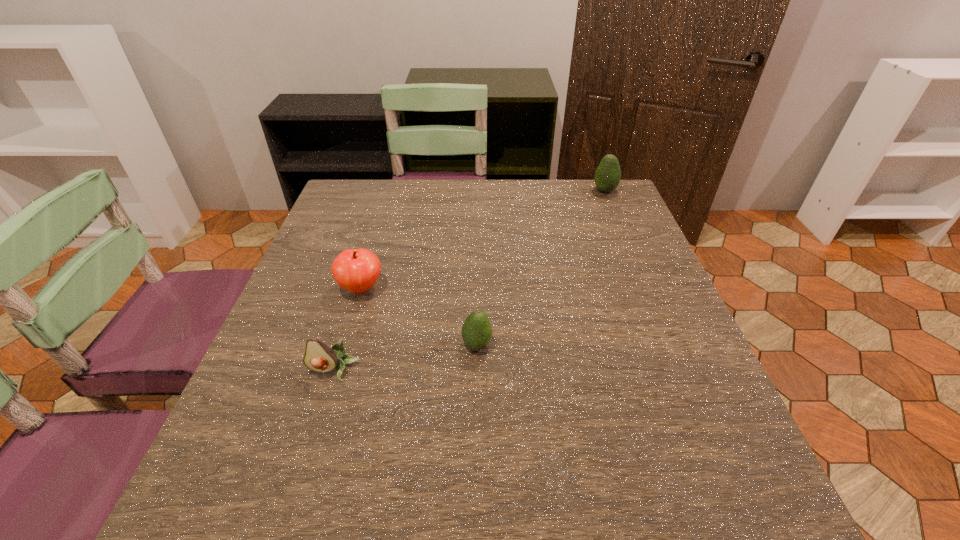
In order to click on vacant area that lies between the second farthest object and the rightmost avocado in this screenshot , I will do `click(483, 240)`.

Identify the location of vacant area between the farthest object and the apple. (483, 240).

This screenshot has width=960, height=540. In order to click on the closest object relative to the second avocado from left to right in this screenshot , I will do `click(319, 357)`.

Identify which object is the third nearest to the nearest avocado. Please provide its 2D coordinates. Your answer should be formatted as a tuple, i.e. [(x, y)], where the tuple contains the x and y coordinates of a point satisfying the conditions above.

[(607, 177)]

Where is `avocado that is the nearest to the third object from left to right`? This screenshot has height=540, width=960. avocado that is the nearest to the third object from left to right is located at coordinates (319, 357).

Choose which avocado is the second nearest neighbor to the second nearest object. Please provide its 2D coordinates. Your answer should be formatted as a tuple, i.e. [(x, y)], where the tuple contains the x and y coordinates of a point satisfying the conditions above.

[(607, 177)]

I want to click on vacant region that satisfies the following two spatial constraints: 1. on the back side of the second nearest object; 2. on the left side of the farthest object, so (478, 191).

Locate an element on the screen. The height and width of the screenshot is (540, 960). vacant space that satisfies the following two spatial constraints: 1. on the back side of the third nearest object; 2. on the left side of the rightmost avocado is located at coordinates (391, 191).

Identify the location of free point that satisfies the following two spatial constraints: 1. on the front side of the apple; 2. on the right side of the second avocado from left to right. The width and height of the screenshot is (960, 540). (345, 345).

The width and height of the screenshot is (960, 540). Identify the location of vacant point that satisfies the following two spatial constraints: 1. on the front side of the apple; 2. on the right side of the second nearest avocado. (345, 345).